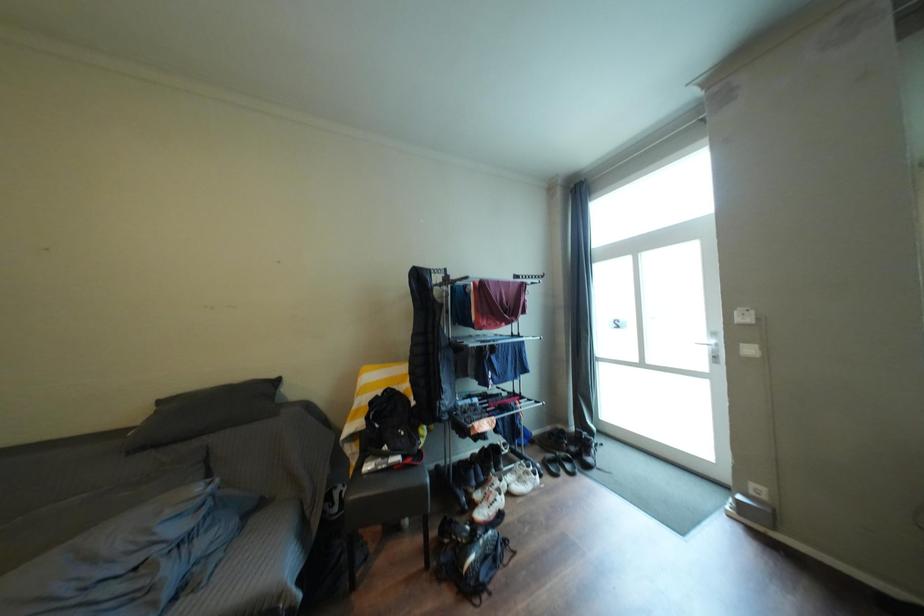
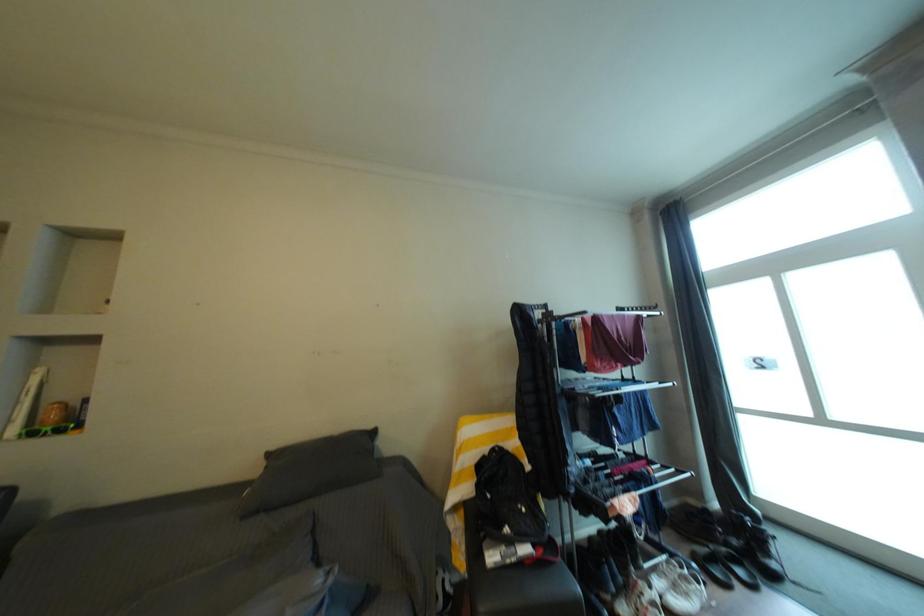
Question: How did the camera likely rotate?

Choices:
 (A) Left
 (B) Right
 (C) Up
 (D) Down

Answer: (A)